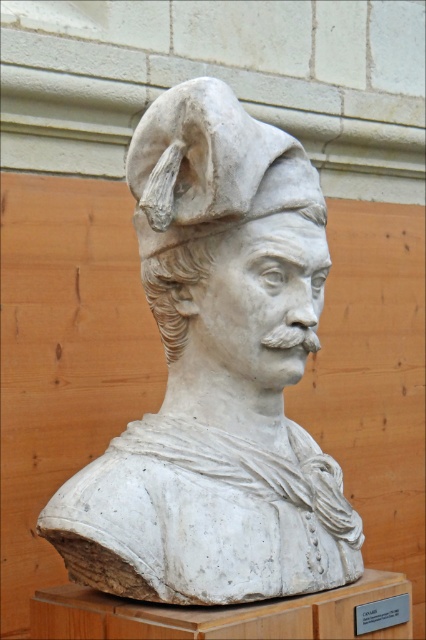
You are an art conservator examining the museum display. You notice two busts in the scene. Which one is closer to you, the white stone bust at center or the white marble bust at center?

The white stone bust at center is closer to you since it is in front of the white marble bust at center.

Based on the coordinates provided, which object is located at point (216,376) in the image?

The point (216,376) marks the white stone bust at center.